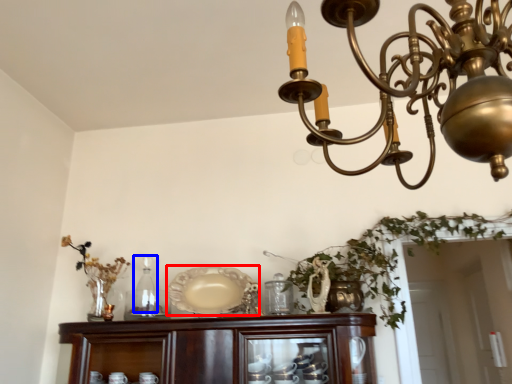
Question: Among these objects, which one is farthest to the camera, platter (highlighted by a red box) or bottle (highlighted by a blue box)?

Choices:
 (A) platter
 (B) bottle

Answer: (B)